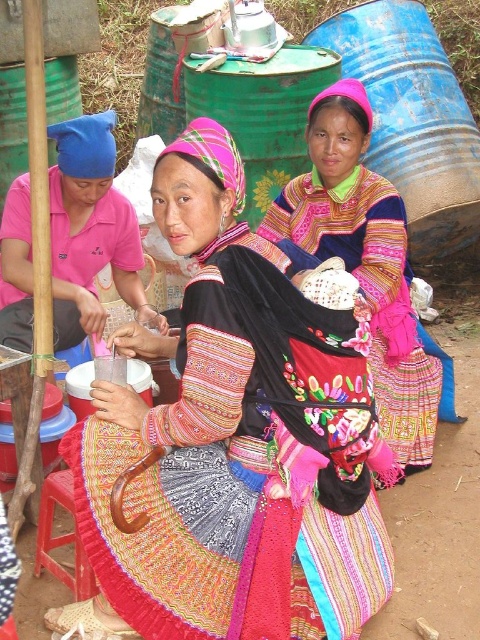
Question: Is velvet embroidered dress at center behind embroidered fabric dress at center?

Choices:
 (A) no
 (B) yes

Answer: (A)

Question: Which object is the closest to the wooden stool at lower left?

Choices:
 (A) pink fabric dress at left
 (B) velvet embroidered dress at center

Answer: (B)

Question: Estimate the real-world distances between objects in this image. Which object is closer to the embroidered fabric dress at center?

Choices:
 (A) velvet embroidered dress at center
 (B) pink fabric dress at left
 (C) wooden stool at lower left

Answer: (B)

Question: Among these objects, which one is farthest from the camera?

Choices:
 (A) embroidered fabric dress at center
 (B) pink fabric dress at left
 (C) wooden stool at lower left
 (D) velvet embroidered dress at center

Answer: (A)

Question: Is pink fabric dress at left closer to camera compared to wooden stool at lower left?

Choices:
 (A) yes
 (B) no

Answer: (B)

Question: Does pink fabric dress at left have a greater width compared to wooden stool at lower left?

Choices:
 (A) yes
 (B) no

Answer: (A)